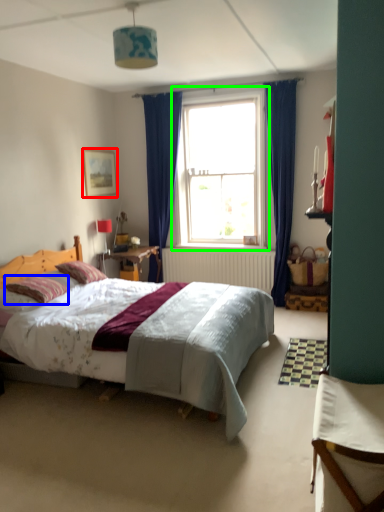
Question: Estimate the real-world distances between objects in this image. Which object is farther from picture frame (highlighted by a red box), pillow (highlighted by a blue box) or window (highlighted by a green box)?

Choices:
 (A) pillow
 (B) window

Answer: (A)